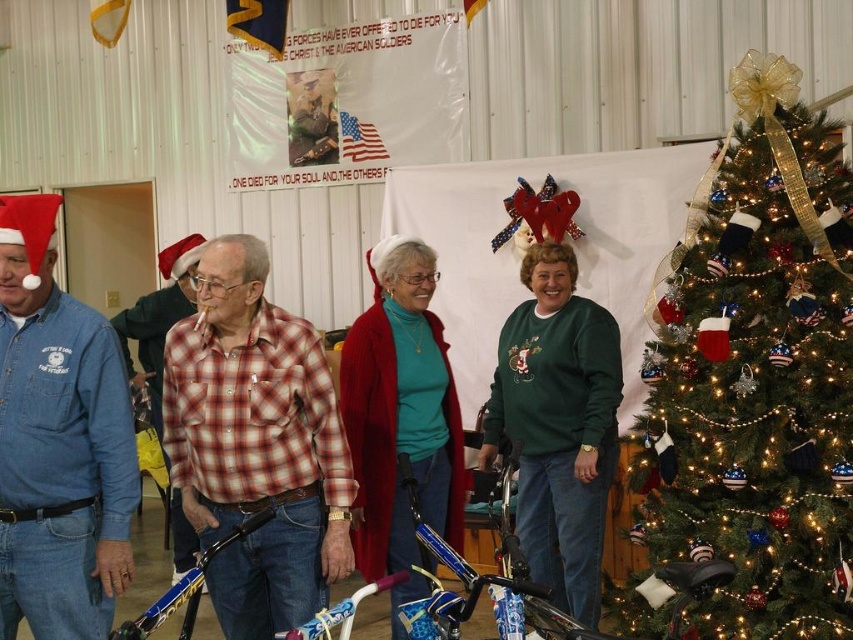
Question: Is denim shirt at left closer to the viewer compared to knitted red sweater at center?

Choices:
 (A) yes
 (B) no

Answer: (A)

Question: Among these objects, which one is farthest from the camera?

Choices:
 (A) green fleece sweater at center
 (B) plaid shirt at center
 (C) green textured christmas tree at right

Answer: (A)

Question: Is the position of plaid shirt at center more distant than that of green fleece sweater at center?

Choices:
 (A) yes
 (B) no

Answer: (B)

Question: Estimate the real-world distances between objects in this image. Which object is closer to the plaid shirt at center?

Choices:
 (A) denim shirt at left
 (B) green fleece sweater at center
 (C) green textured christmas tree at right
 (D) metallic blue bicycle at center

Answer: (D)

Question: Which point appears farthest from the camera in this image?

Choices:
 (A) (527, 440)
 (B) (433, 438)

Answer: (A)

Question: Does green textured christmas tree at right appear on the left side of knitted red sweater at center?

Choices:
 (A) no
 (B) yes

Answer: (A)